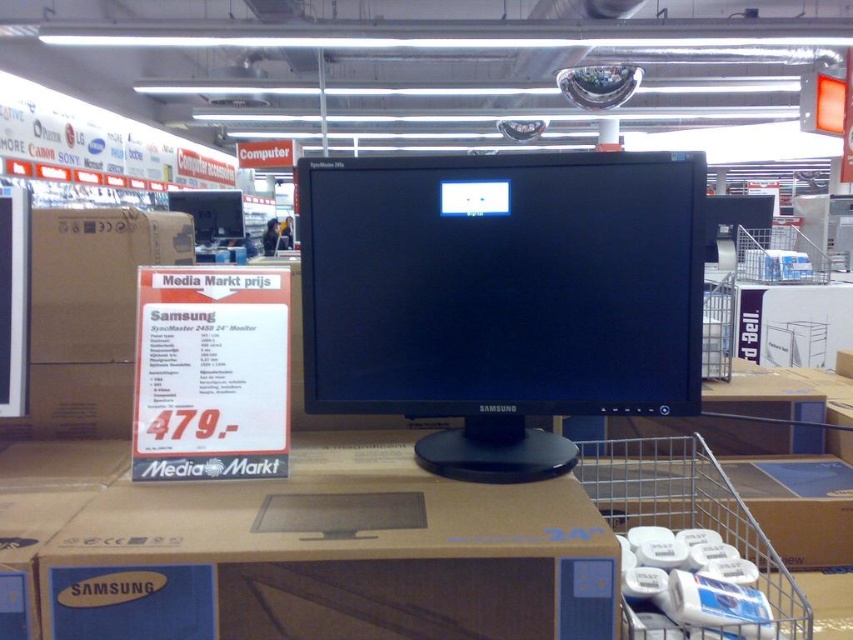
Does matte black monitor at center appear on the right side of matte black monitor at upper center?

Indeed, matte black monitor at center is positioned on the right side of matte black monitor at upper center.

Who is lower down, matte black monitor at center or matte black monitor at upper center?

matte black monitor at center

Is point (489, 436) positioned in front of point (210, 204)?

That is True.

You are a GUI agent. You are given a task and a screenshot of the screen. Output one action in this format:
    pyautogui.click(x=<x>, y=<y>)
    Task: Click on the matte black monitor at center
    The width and height of the screenshot is (853, 640).
    Given the screenshot: What is the action you would take?
    pyautogui.click(x=502, y=296)